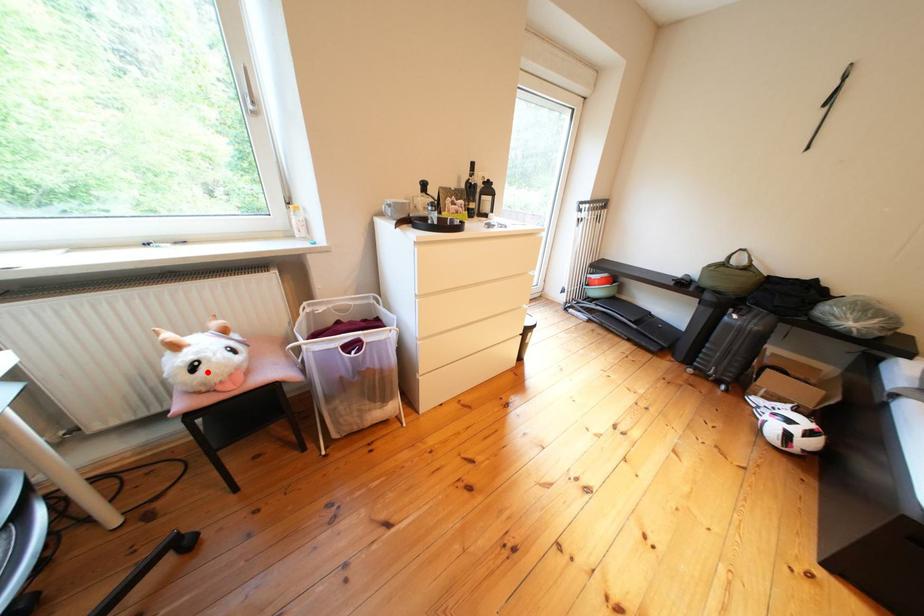
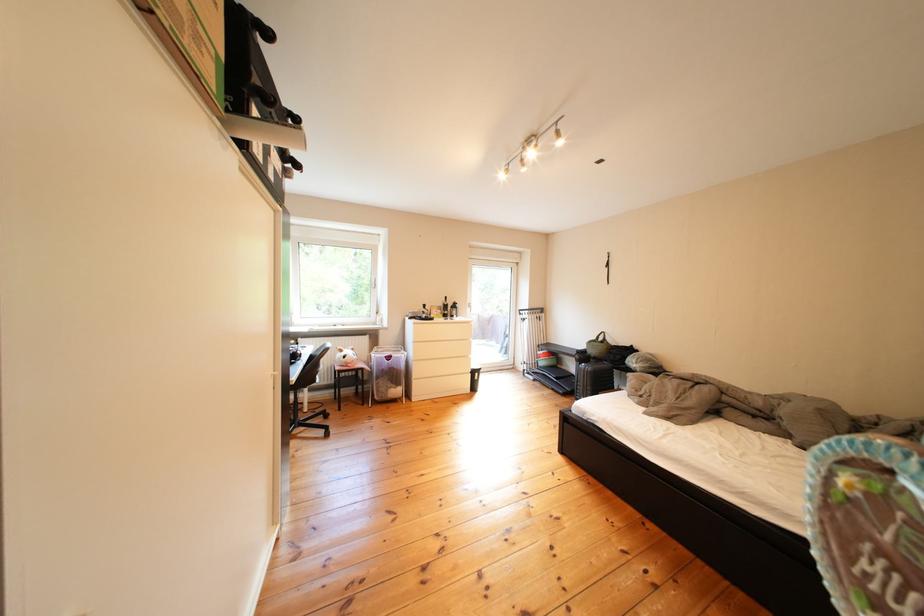
The point at the highlighted location is marked in the first image. Where is the corresponding point in the second image?

(359, 361)